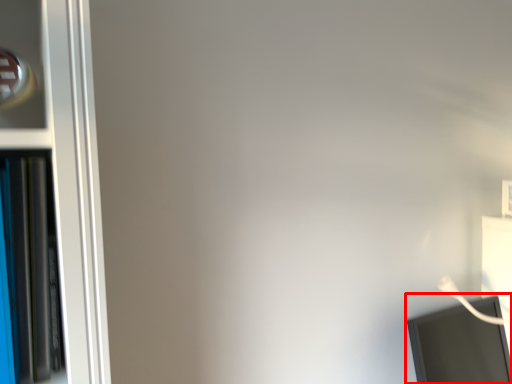
Question: From the image's perspective, what is the correct spatial positioning of computer monitor (annotated by the red box) in reference to bookcase?

Choices:
 (A) below
 (B) above

Answer: (A)